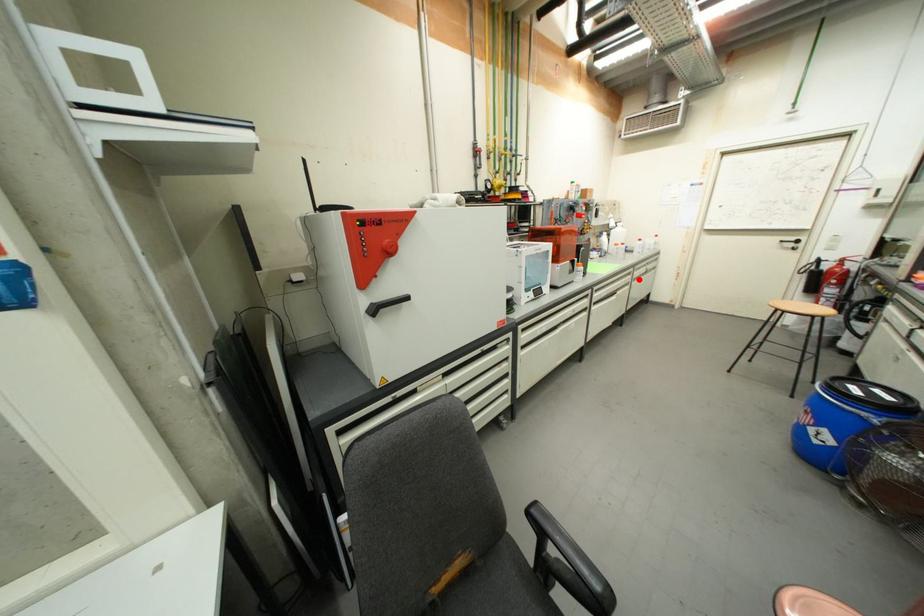
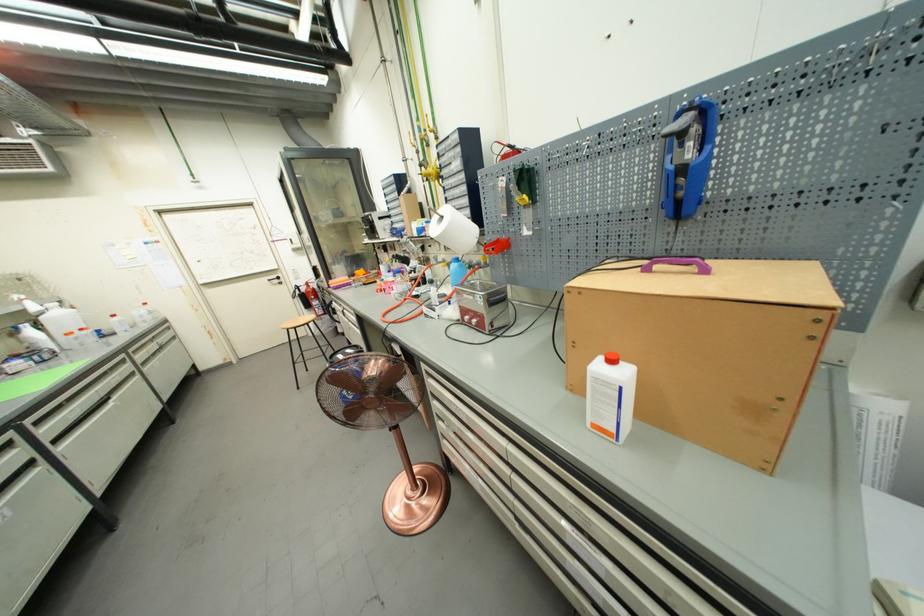
Find the pixel in the second image that matches the highlighted location in the first image.

(146, 363)